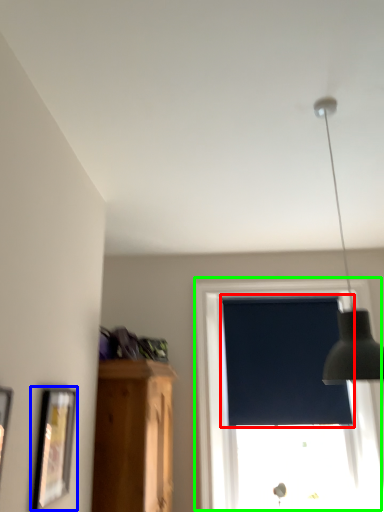
Question: Which object is the farthest from window screen (highlighted by a red box)? Choose among these: picture frame (highlighted by a blue box) or window (highlighted by a green box).

Choices:
 (A) picture frame
 (B) window

Answer: (A)